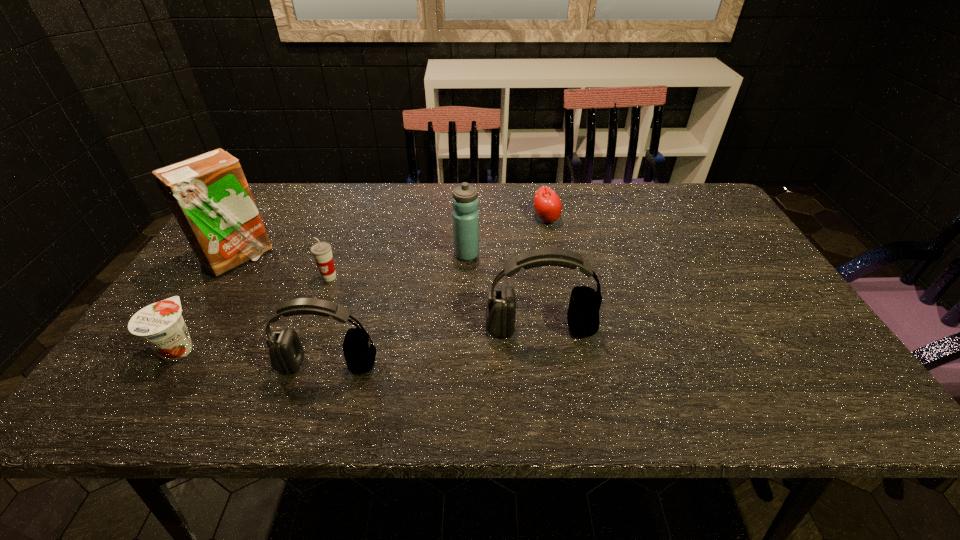
Locate an element on the screen. vacant point at the far edge is located at coordinates (624, 187).

Where is `vacant area at the near edge`? This screenshot has height=540, width=960. vacant area at the near edge is located at coordinates (684, 341).

In the image, there is a desktop. Identify the location of vacant space at the left edge. (224, 299).

In order to click on free spot between the shorter headset and the third object from right to left in this screenshot , I will do `click(397, 309)`.

At what (x,y) coordinates should I click in order to perform the action: click on vacant space that's between the nearer headset and the cup. Please return your answer as a coordinate pair (x, y). Looking at the image, I should click on (328, 321).

This screenshot has width=960, height=540. Find the location of `free space between the fourth tallest object and the taller headset`. free space between the fourth tallest object and the taller headset is located at coordinates (434, 346).

Locate an element on the screen. The width and height of the screenshot is (960, 540). free space between the cup and the tallest object is located at coordinates (283, 268).

I want to click on blank region between the farther headset and the apple, so click(x=543, y=274).

You are a GUI agent. You are given a task and a screenshot of the screen. Output one action in this format:
    pyautogui.click(x=<x>, y=<y>)
    Task: Click on the empty space that is in between the water bottle and the carton
    
    Given the screenshot: What is the action you would take?
    pyautogui.click(x=352, y=256)

Locate an element on the screen. This screenshot has height=540, width=960. object that stands as the closest to the farther headset is located at coordinates (465, 202).